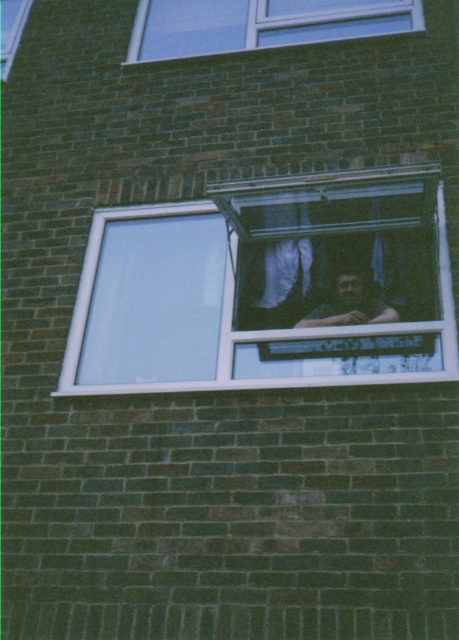
Question: Can you confirm if clear glass window at center is positioned above transparent glass window at upper center?

Choices:
 (A) yes
 (B) no

Answer: (B)

Question: Which of the following is the farthest from the observer?

Choices:
 (A) (308, 321)
 (B) (307, 266)
 (C) (175, 51)

Answer: (C)

Question: Is clear glass window at center above transparent glass window at upper center?

Choices:
 (A) yes
 (B) no

Answer: (B)

Question: Which object is the farthest from the dark brown hair at center?

Choices:
 (A) transparent glass window at upper center
 (B) clear glass window at center

Answer: (A)

Question: Which point is farther to the camera?

Choices:
 (A) (364, 314)
 (B) (184, 51)

Answer: (B)

Question: Can you confirm if clear glass window at center is positioned above dark brown hair at center?

Choices:
 (A) yes
 (B) no

Answer: (A)